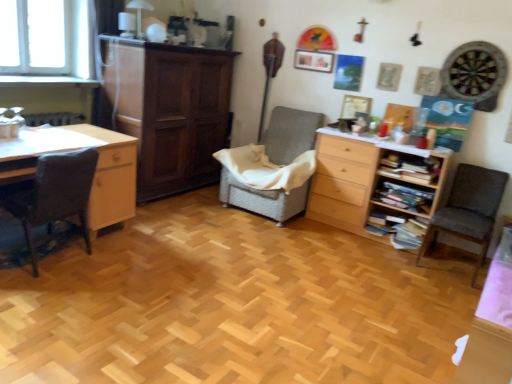
Question: Can you confirm if woven fabric chair at center, arranged as the 2th chair when viewed from the left, is smaller than wooden bookshelf at right, acting as the 1th shelf starting from the top?

Choices:
 (A) no
 (B) yes

Answer: (A)

Question: Is woven fabric chair at center, positioned as the second chair in right-to-left order, positioned beyond the bounds of wooden bookshelf at right, which appears as the 2th shelf when ordered from the bottom?

Choices:
 (A) no
 (B) yes

Answer: (B)

Question: From a real-world perspective, is woven fabric chair at center, arranged as the 2th chair when viewed from the left, positioned over wooden bookshelf at right, which appears as the 2th shelf when ordered from the bottom, based on gravity?

Choices:
 (A) yes
 (B) no

Answer: (B)

Question: Is woven fabric chair at center, arranged as the 2th chair when viewed from the left, taller than wooden bookshelf at right, acting as the 1th shelf starting from the top?

Choices:
 (A) yes
 (B) no

Answer: (A)

Question: Can you confirm if woven fabric chair at center, positioned as the second chair in right-to-left order, is shorter than wooden bookshelf at right, acting as the 1th shelf starting from the top?

Choices:
 (A) no
 (B) yes

Answer: (A)

Question: From the image's perspective, is woven fabric chair at center, positioned as the second chair in right-to-left order, above or below wooden bookshelf at right, which is the 1th shelf in bottom-to-top order?

Choices:
 (A) above
 (B) below

Answer: (A)

Question: Which is correct: woven fabric chair at center, positioned as the second chair in right-to-left order, is inside wooden bookshelf at right, which is the 1th shelf in bottom-to-top order, or outside of it?

Choices:
 (A) inside
 (B) outside

Answer: (B)

Question: Is woven fabric chair at center, arranged as the 2th chair when viewed from the left, taller or shorter than wooden bookshelf at right, which is the 2th shelf in top-to-bottom order?

Choices:
 (A) short
 (B) tall

Answer: (B)

Question: In terms of width, does woven fabric chair at center, arranged as the 2th chair when viewed from the left, look wider or thinner when compared to wooden bookshelf at right, which is the 2th shelf in top-to-bottom order?

Choices:
 (A) wide
 (B) thin

Answer: (A)

Question: Based on their sizes in the image, would you say dark gray fabric chair at left, the third chair from the right, is bigger or smaller than woven fabric chair at center, arranged as the 2th chair when viewed from the left?

Choices:
 (A) big
 (B) small

Answer: (B)

Question: From the image's perspective, relative to woven fabric chair at center, positioned as the second chair in right-to-left order, is dark gray fabric chair at left, the first chair from the left, above or below?

Choices:
 (A) above
 (B) below

Answer: (B)

Question: Relative to woven fabric chair at center, arranged as the 2th chair when viewed from the left, is dark gray fabric chair at left, the third chair from the right, in front or behind?

Choices:
 (A) behind
 (B) front

Answer: (B)

Question: Would you say dark gray fabric chair at left, the third chair from the right, is to the left or to the right of woven fabric chair at center, arranged as the 2th chair when viewed from the left, in the picture?

Choices:
 (A) left
 (B) right

Answer: (A)

Question: From the image's perspective, is woven fabric chair at center, arranged as the 2th chair when viewed from the left, located above or below dark gray fabric chair at right, which appears as the third chair when viewed from the left?

Choices:
 (A) below
 (B) above

Answer: (B)

Question: Visually, is woven fabric chair at center, positioned as the second chair in right-to-left order, positioned to the left or to the right of dark gray fabric chair at right, the first chair from the right?

Choices:
 (A) right
 (B) left

Answer: (B)